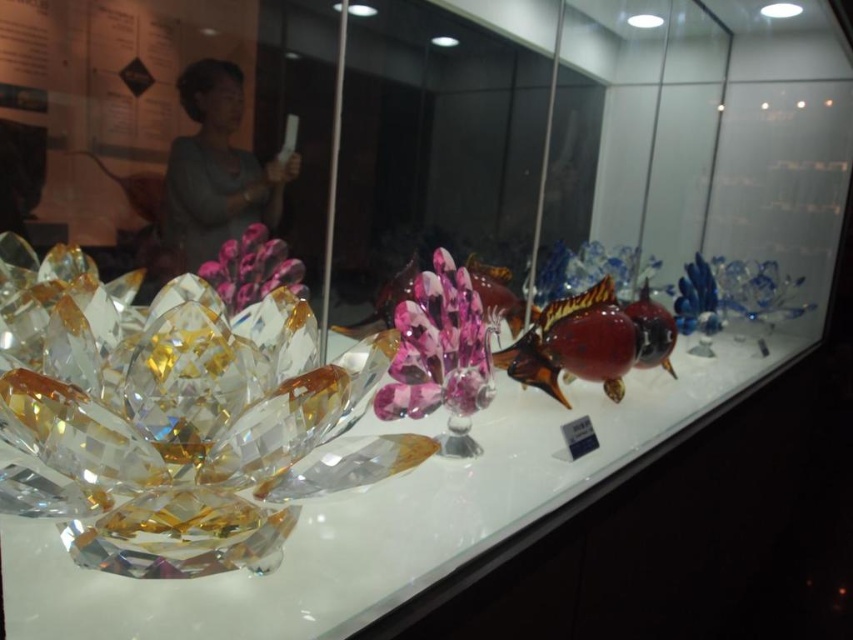
You are standing in front of the glass display case and want to touch both points inside the case. Which point, point (403, 484) or point (186, 205), is closer to you?

Point (403, 484) is closer to the viewer than point (186, 205).

You are standing in front of the glass display case and want to touch the point at coordinate (509, 474). Can you reach it without moving your position?

The point at coordinate (509, 474) is 1.06 meters away from the viewer, so you can reach it without moving your position if your arm can extend that far.

You are an interior designer assessing the display case. You need to determine the relative sizes of the transparent crystal lotus at lower left and the gray fabric at upper left. Which one is larger?

The transparent crystal lotus at lower left is bigger than the gray fabric at upper left according to the description.